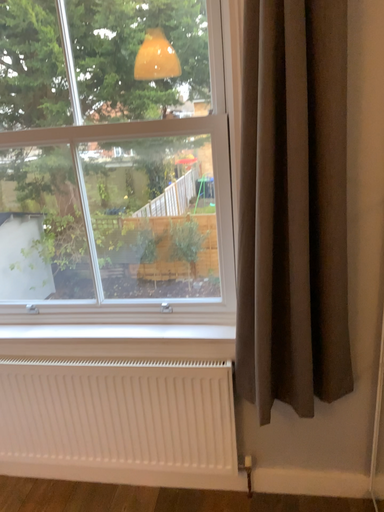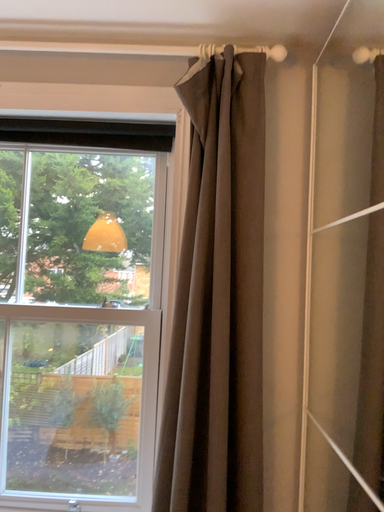
Question: How did the camera likely rotate when shooting the video?

Choices:
 (A) rotated left
 (B) rotated right

Answer: (B)